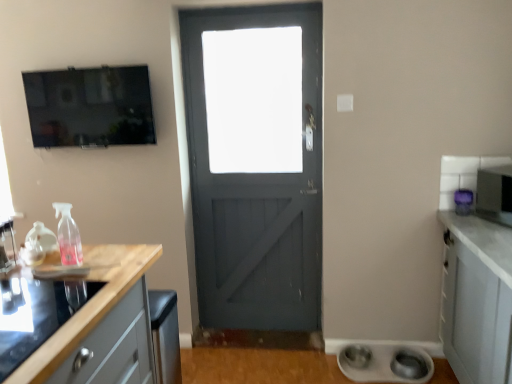
Question: From a real-world perspective, is purple plastic microwave at right, the 2th appliance positioned from the left, located higher than wooden at left?

Choices:
 (A) yes
 (B) no

Answer: (A)

Question: Does purple plastic microwave at right, the 2th appliance from the bottom, have a lesser width compared to wooden at left?

Choices:
 (A) yes
 (B) no

Answer: (A)

Question: Is purple plastic microwave at right, which is the 2th appliance in right-to-left order, taller than wooden at left?

Choices:
 (A) yes
 (B) no

Answer: (B)

Question: Is purple plastic microwave at right, which is the 2th appliance in right-to-left order, wider than wooden at left?

Choices:
 (A) no
 (B) yes

Answer: (A)

Question: Is purple plastic microwave at right, which is the 2th appliance in right-to-left order, not inside wooden at left?

Choices:
 (A) no
 (B) yes

Answer: (B)

Question: From a real-world perspective, is purple plastic microwave at right, the second appliance when ordered from top to bottom, beneath wooden at left?

Choices:
 (A) yes
 (B) no

Answer: (B)

Question: Is wooden at left at the back of white matte bowls at lower right, positioned as the 1th appliance in left-to-right order?

Choices:
 (A) yes
 (B) no

Answer: (B)

Question: Are white matte bowls at lower right, the 3th appliance viewed from the right, and wooden at left far apart?

Choices:
 (A) yes
 (B) no

Answer: (A)

Question: Considering the relative sizes of white matte bowls at lower right, which is the first appliance from bottom to top, and wooden at left in the image provided, is white matte bowls at lower right, which is the first appliance from bottom to top, bigger than wooden at left?

Choices:
 (A) yes
 (B) no

Answer: (B)

Question: Considering the relative sizes of white matte bowls at lower right, positioned as the 1th appliance in left-to-right order, and wooden at left in the image provided, is white matte bowls at lower right, positioned as the 1th appliance in left-to-right order, shorter than wooden at left?

Choices:
 (A) no
 (B) yes

Answer: (B)

Question: Is white matte bowls at lower right, which is the first appliance from bottom to top, positioned before wooden at left?

Choices:
 (A) no
 (B) yes

Answer: (A)

Question: Does white matte bowls at lower right, which appears as the 3th appliance when viewed from the top, appear on the left side of wooden at left?

Choices:
 (A) no
 (B) yes

Answer: (A)

Question: From the image's perspective, would you say wooden at left is positioned over metallic silver microwave at right, which appears as the 1th appliance when viewed from the right?

Choices:
 (A) yes
 (B) no

Answer: (B)